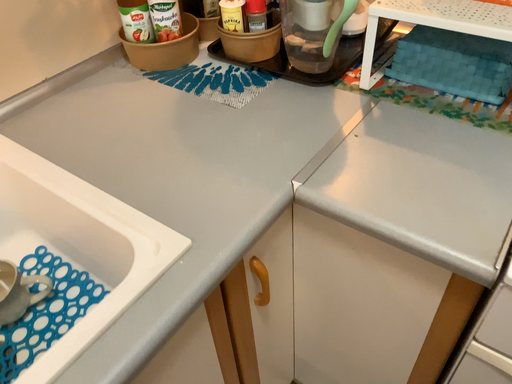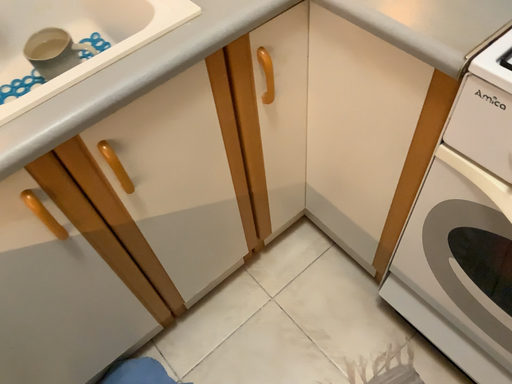
Question: How did the camera likely rotate when shooting the video?

Choices:
 (A) rotated downward
 (B) rotated upward

Answer: (A)